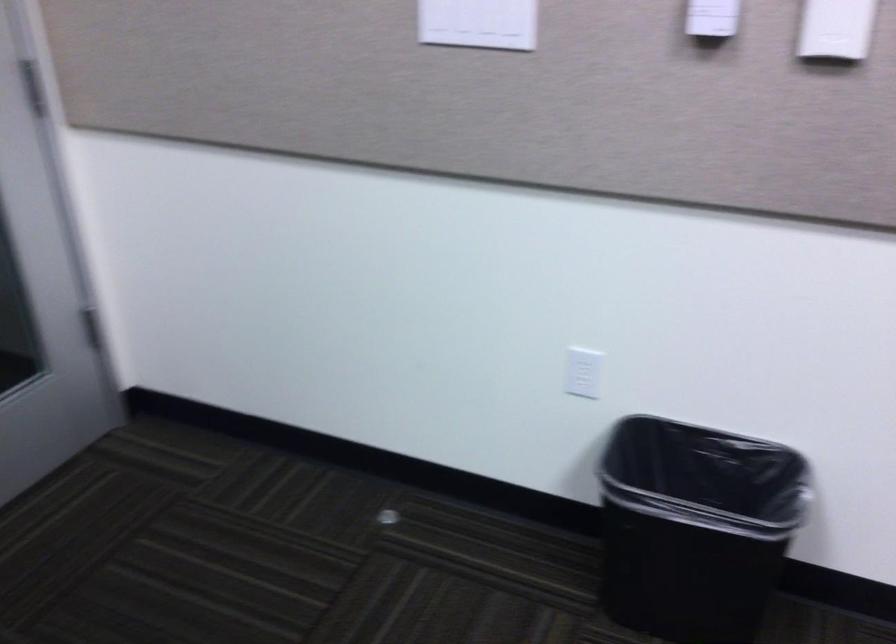
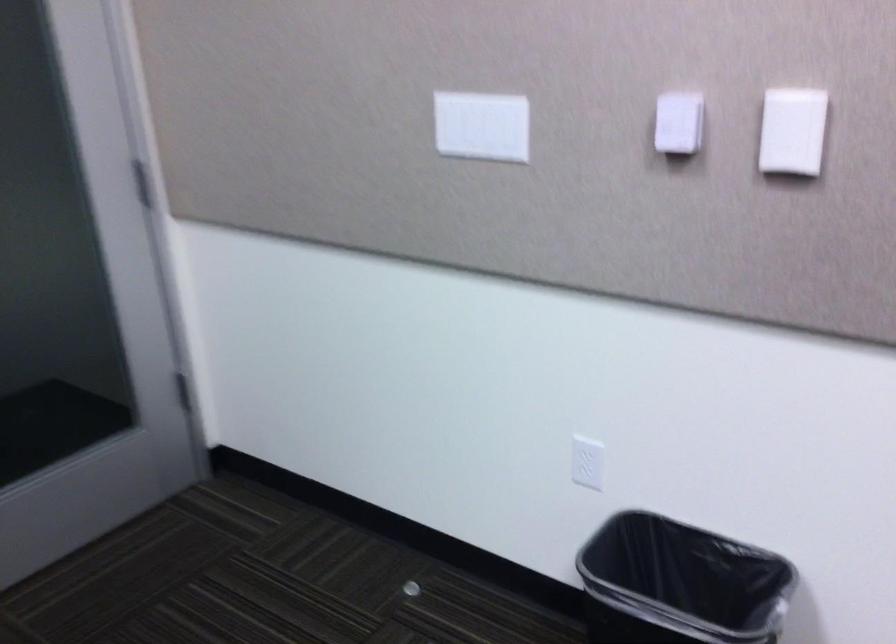
Question: The images are taken continuously from a first-person perspective. In which direction are you moving?

Choices:
 (A) Left
 (B) Right
 (C) Forward
 (D) Backward

Answer: (B)